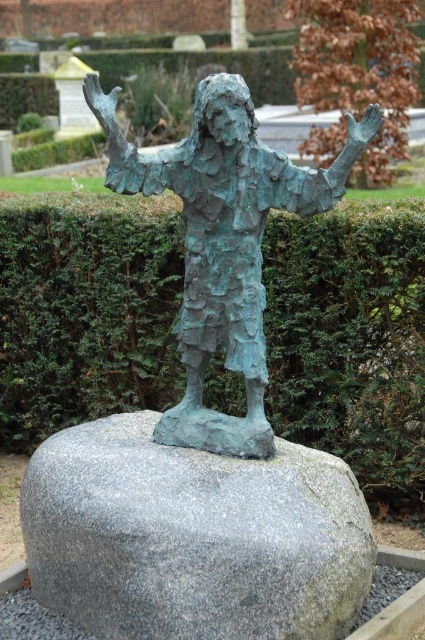
Question: Is green textured hedge at center below green patina statue at center?

Choices:
 (A) no
 (B) yes

Answer: (B)

Question: Does green textured hedge at center have a greater width compared to green patina statue at center?

Choices:
 (A) yes
 (B) no

Answer: (A)

Question: Which point is closer to the camera?

Choices:
 (A) (218, 317)
 (B) (184, 534)
 (C) (133, 369)

Answer: (B)

Question: Which point appears farthest from the camera in this image?

Choices:
 (A) (39, 506)
 (B) (210, 342)
 (C) (278, 259)

Answer: (C)

Question: Which object is farther from the camera taking this photo?

Choices:
 (A) green patina statue at center
 (B) gray granite rock at center

Answer: (A)

Question: Can you confirm if green textured hedge at center is positioned to the right of gray granite rock at center?

Choices:
 (A) no
 (B) yes

Answer: (A)